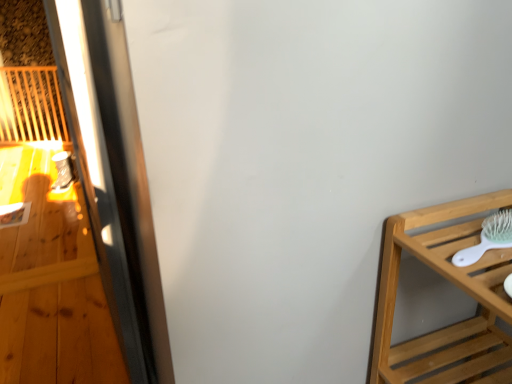
Question: Considering the relative positions of light brown wooden shelf at right and metallic screen door at left in the image provided, is light brown wooden shelf at right behind metallic screen door at left?

Choices:
 (A) no
 (B) yes

Answer: (A)

Question: Is light brown wooden shelf at right thinner than metallic screen door at left?

Choices:
 (A) yes
 (B) no

Answer: (B)

Question: Is light brown wooden shelf at right facing towards metallic screen door at left?

Choices:
 (A) yes
 (B) no

Answer: (B)

Question: Is light brown wooden shelf at right not close to metallic screen door at left?

Choices:
 (A) no
 (B) yes

Answer: (A)

Question: Can you confirm if light brown wooden shelf at right is taller than metallic screen door at left?

Choices:
 (A) no
 (B) yes

Answer: (A)

Question: In terms of width, does light brown wooden shelf at right look wider or thinner when compared to metallic screen door at left?

Choices:
 (A) thin
 (B) wide

Answer: (B)

Question: From a real-world perspective, relative to metallic screen door at left, is light brown wooden shelf at right vertically above or below?

Choices:
 (A) above
 (B) below

Answer: (B)

Question: Relative to metallic screen door at left, is light brown wooden shelf at right in front or behind?

Choices:
 (A) behind
 (B) front

Answer: (B)

Question: From the image's perspective, is light brown wooden shelf at right located above or below metallic screen door at left?

Choices:
 (A) below
 (B) above

Answer: (A)

Question: Considering the positions of white plastic brush at right and light brown wooden shelf at right in the image, is white plastic brush at right taller or shorter than light brown wooden shelf at right?

Choices:
 (A) tall
 (B) short

Answer: (B)

Question: From the image's perspective, is white plastic brush at right positioned above or below light brown wooden shelf at right?

Choices:
 (A) below
 (B) above

Answer: (B)

Question: Considering the relative positions of white plastic brush at right and light brown wooden shelf at right in the image provided, is white plastic brush at right to the left or to the right of light brown wooden shelf at right?

Choices:
 (A) right
 (B) left

Answer: (B)

Question: Based on their sizes in the image, would you say white plastic brush at right is bigger or smaller than light brown wooden shelf at right?

Choices:
 (A) big
 (B) small

Answer: (B)

Question: From their relative heights in the image, would you say metallic screen door at left is taller or shorter than light brown wooden shelf at right?

Choices:
 (A) tall
 (B) short

Answer: (A)

Question: From the image's perspective, is metallic screen door at left above or below light brown wooden shelf at right?

Choices:
 (A) below
 (B) above

Answer: (B)